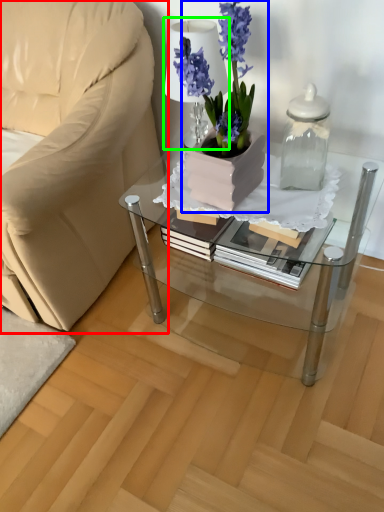
Question: Considering the real-world distances, which object is closest to chair (highlighted by a red box)? houseplant (highlighted by a blue box) or table lamp (highlighted by a green box).

Choices:
 (A) houseplant
 (B) table lamp

Answer: (B)